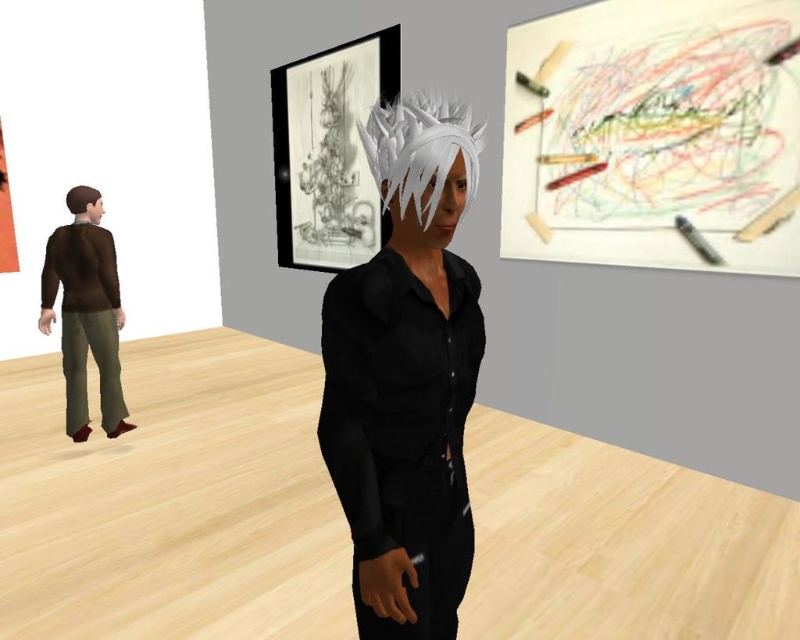
Does colored crayons at upper right have a greater width compared to white matte hair at center?

Correct, the width of colored crayons at upper right exceeds that of white matte hair at center.

Is colored crayons at upper right to the right of white matte hair at center from the viewer's perspective?

Yes, colored crayons at upper right is to the right of white matte hair at center.

Measure the distance between point (788, 157) and camera.

Point (788, 157) and camera are 8.82 feet apart.

Image resolution: width=800 pixels, height=640 pixels. I want to click on colored crayons at upper right, so click(x=654, y=134).

Does shiny black hair at center appear on the right side of white matte hair at center?

Incorrect, shiny black hair at center is not on the right side of white matte hair at center.

This screenshot has height=640, width=800. What are the coordinates of `shiny black hair at center` in the screenshot? It's located at (406, 376).

Is point (440, 397) closer to camera compared to point (472, 170)?

No, (440, 397) is behind (472, 170).

What are the coordinates of `shiny black hair at center` in the screenshot? It's located at [x=406, y=376].

Which of these two, colored crayons at upper right or brown matte hair at left, stands taller?

colored crayons at upper right

Who is positioned more to the right, colored crayons at upper right or brown matte hair at left?

colored crayons at upper right is more to the right.

Who is more forward, (600, 241) or (92, 204)?

Point (92, 204) is more forward.

Locate an element on the screen. This screenshot has width=800, height=640. colored crayons at upper right is located at coordinates (654, 134).